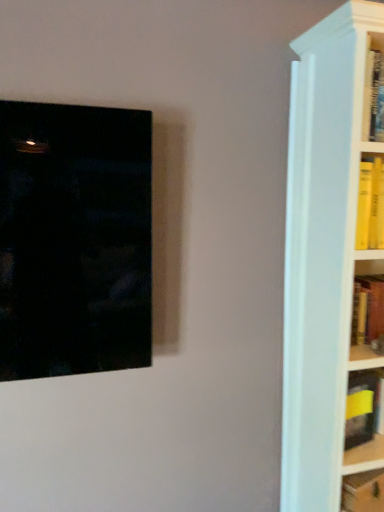
Question: Based on their sizes in the image, would you say yellow hardcover book at lower right, which appears as the 2th book when viewed from the top, is bigger or smaller than yellow matte book at right, which is the first book from top to bottom?

Choices:
 (A) small
 (B) big

Answer: (B)

Question: Is yellow hardcover book at lower right, the first book from the bottom, situated inside yellow matte book at right, which is the first book from top to bottom, or outside?

Choices:
 (A) inside
 (B) outside

Answer: (B)

Question: Estimate the real-world distances between objects in this image. Which object is farther from the yellow hardcover book at lower right, the first book from the bottom?

Choices:
 (A) yellow matte book at right, marked as the second book in a bottom-to-top arrangement
 (B) matte black picture frame at left

Answer: (B)

Question: Considering the real-world distances, which object is farthest from the matte black picture frame at left?

Choices:
 (A) yellow hardcover book at lower right, which appears as the 2th book when viewed from the top
 (B) yellow matte book at right, marked as the second book in a bottom-to-top arrangement

Answer: (A)